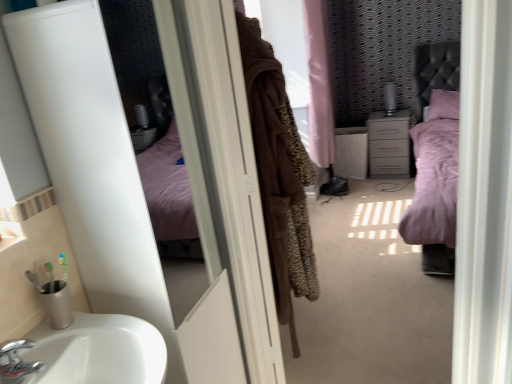
Question: Can you confirm if white glossy screen door at upper left, which is counted as the second screen door, starting from the right, is taller than brown fuzzy coat at center?

Choices:
 (A) no
 (B) yes

Answer: (B)

Question: Is there a large distance between white glossy screen door at upper left, which is counted as the second screen door, starting from the right, and brown fuzzy coat at center?

Choices:
 (A) no
 (B) yes

Answer: (A)

Question: Does white glossy screen door at upper left, which is the 1th screen door in left-to-right order, appear on the left side of brown fuzzy coat at center?

Choices:
 (A) no
 (B) yes

Answer: (B)

Question: Is white glossy screen door at upper left, which is the 1th screen door in left-to-right order, positioned beyond the bounds of brown fuzzy coat at center?

Choices:
 (A) yes
 (B) no

Answer: (A)

Question: From the image's perspective, is white glossy screen door at upper left, which is counted as the second screen door, starting from the right, under brown fuzzy coat at center?

Choices:
 (A) no
 (B) yes

Answer: (B)

Question: From a real-world perspective, is white glossy screen door at upper left, which is the 1th screen door in left-to-right order, located higher than brown fuzzy coat at center?

Choices:
 (A) yes
 (B) no

Answer: (B)

Question: From the image's perspective, does white glossy screen door at upper left, which is the 1th screen door in left-to-right order, appear lower than pink plush bed at center?

Choices:
 (A) no
 (B) yes

Answer: (B)

Question: Are white glossy screen door at upper left, which is the 1th screen door in left-to-right order, and pink plush bed at center located far from each other?

Choices:
 (A) no
 (B) yes

Answer: (B)

Question: From a real-world perspective, is white glossy screen door at upper left, which is the 1th screen door in left-to-right order, on top of pink plush bed at center?

Choices:
 (A) yes
 (B) no

Answer: (A)

Question: Can you confirm if white glossy screen door at upper left, which is the 1th screen door in left-to-right order, is thinner than pink plush bed at center?

Choices:
 (A) yes
 (B) no

Answer: (A)

Question: Is white glossy screen door at upper left, which is the 1th screen door in left-to-right order, next to pink plush bed at center and touching it?

Choices:
 (A) yes
 (B) no

Answer: (B)

Question: Does white glossy screen door at upper left, which is the 1th screen door in left-to-right order, turn towards pink plush bed at center?

Choices:
 (A) yes
 (B) no

Answer: (B)

Question: Considering the relative sizes of matte gray chest of drawers at center and chrome metallic faucet at lower left in the image provided, is matte gray chest of drawers at center taller than chrome metallic faucet at lower left?

Choices:
 (A) yes
 (B) no

Answer: (A)